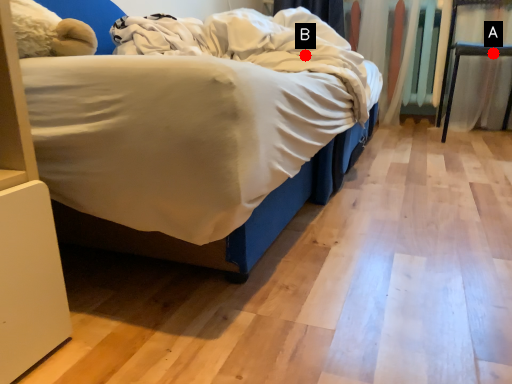
Question: Two points are circled on the image, labeled by A and B beside each circle. Which point is further to the camera?

Choices:
 (A) A is further
 (B) B is further

Answer: (A)